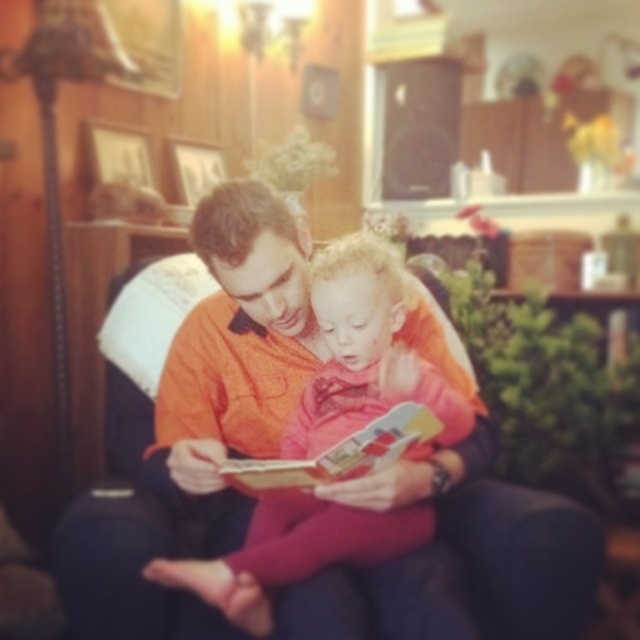
You are a designer trying to place a new decorative item in the living room. The pink fabric at center is marked by point (340,560). If you want to place the new item 0.2 units to the right of this point, what coordinate would that be?

The new coordinate would be 0.875 plus 0.2 equals 1.075 in the x direction, so the coordinate is 1.075, 0.533.

You are taking a photo of the scene and want to focus on both point (451, 422) and point (250, 465). Which point is closer to the camera?

Point (250, 465) is closer to the camera than point (451, 422).